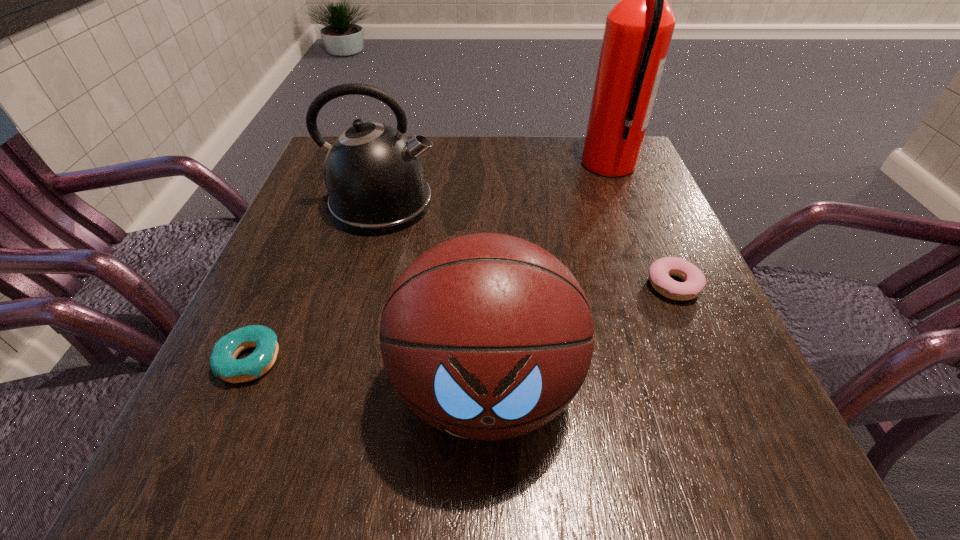
In order to click on object that is at the far left corner in this screenshot , I will do `click(375, 177)`.

Locate an element on the screen. object present at the far right corner is located at coordinates (638, 31).

Identify the location of free region at the far edge. This screenshot has width=960, height=540. (450, 185).

Locate an element on the screen. The width and height of the screenshot is (960, 540). free point at the near edge is located at coordinates (468, 444).

Locate an element on the screen. The height and width of the screenshot is (540, 960). vacant space at the left edge of the desktop is located at coordinates (278, 238).

The height and width of the screenshot is (540, 960). In order to click on free region at the right edge of the desktop in this screenshot , I will do `click(653, 230)`.

Find the location of a particular element. vacant space at the near left corner is located at coordinates (261, 441).

The image size is (960, 540). In order to click on free space between the kettle and the nearer doughnut in this screenshot , I will do `click(315, 282)`.

Find the location of `unoccupied area between the nearer doughnut and the kettle`. unoccupied area between the nearer doughnut and the kettle is located at coordinates (315, 282).

Where is `empty location between the basketball and the left doughnut`? This screenshot has height=540, width=960. empty location between the basketball and the left doughnut is located at coordinates (368, 374).